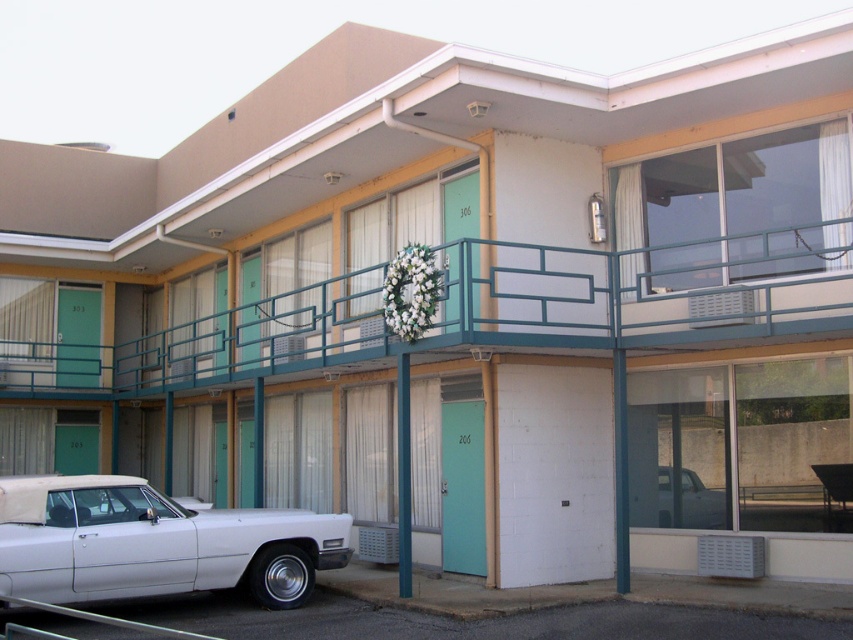
Based on the photo, does white glossy car at lower left have a smaller size compared to white glossy truck at lower right?

Result: Actually, white glossy car at lower left might be larger than white glossy truck at lower right.

Find the location of `white glossy car at lower left`. white glossy car at lower left is located at coordinates (154, 544).

Between teal metal railing at upper center and white glossy car at lower left, which one is positioned lower?

white glossy car at lower left is below.

Who is more forward, (553, 273) or (22, 490)?

Positioned in front is point (22, 490).

Locate an element on the screen. This screenshot has width=853, height=640. teal metal railing at upper center is located at coordinates (474, 312).

Describe the element at coordinates (474, 312) in the screenshot. The image size is (853, 640). I see `teal metal railing at upper center` at that location.

Can you confirm if teal metal railing at upper center is wider than white glossy truck at lower right?

Correct, the width of teal metal railing at upper center exceeds that of white glossy truck at lower right.

You are a GUI agent. You are given a task and a screenshot of the screen. Output one action in this format:
    pyautogui.click(x=<x>, y=<y>)
    Task: Click on the teal metal railing at upper center
    This screenshot has height=640, width=853.
    Given the screenshot: What is the action you would take?
    pyautogui.click(x=474, y=312)